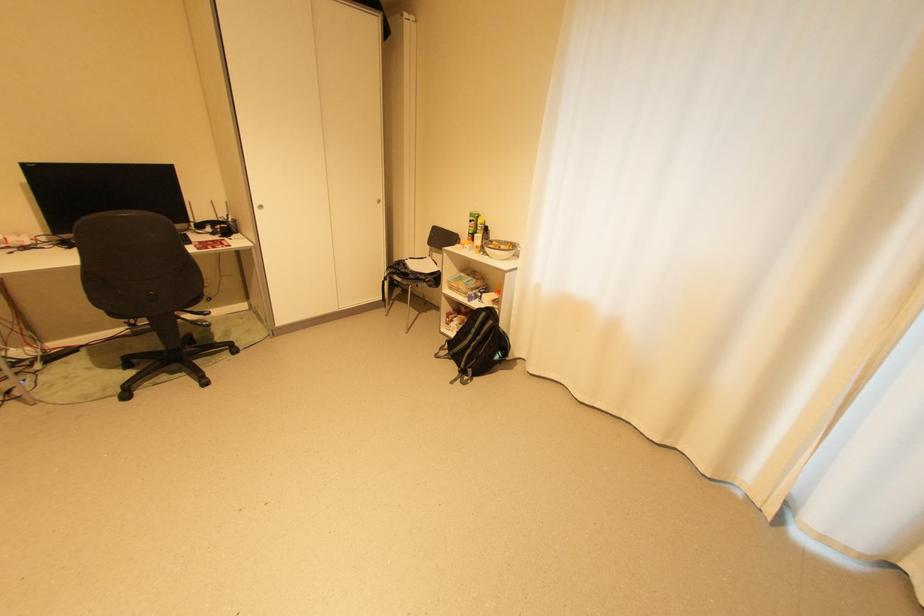
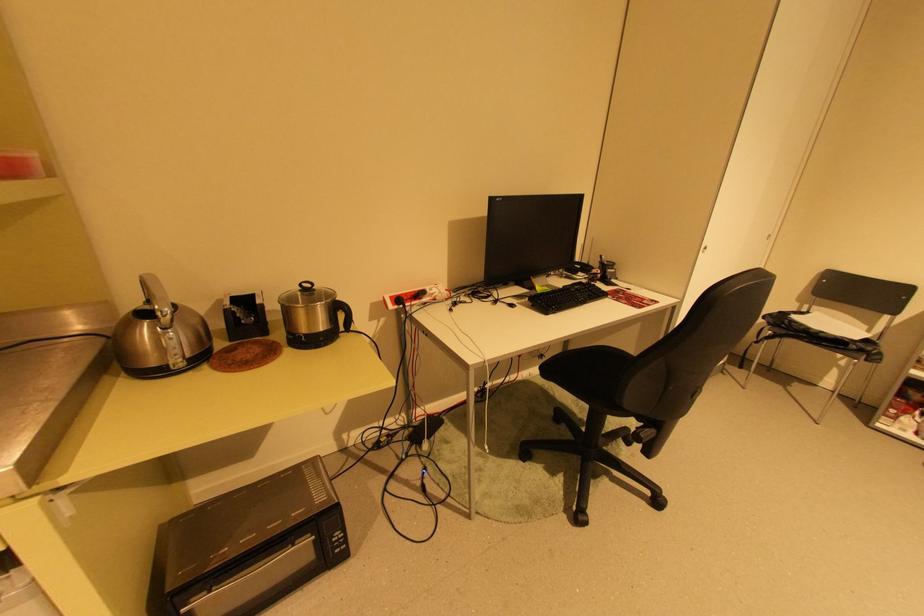
Question: The images are taken continuously from a first-person perspective. In which direction are you moving?

Choices:
 (A) Left
 (B) Right
 (C) Forward
 (D) Backward

Answer: (A)